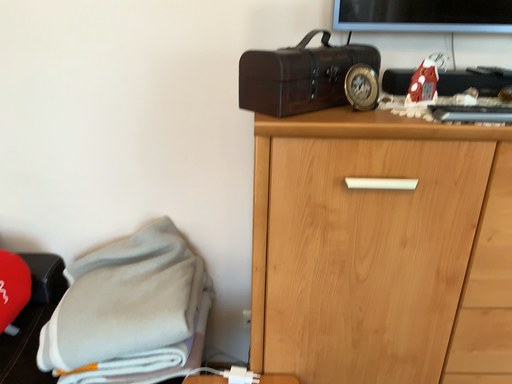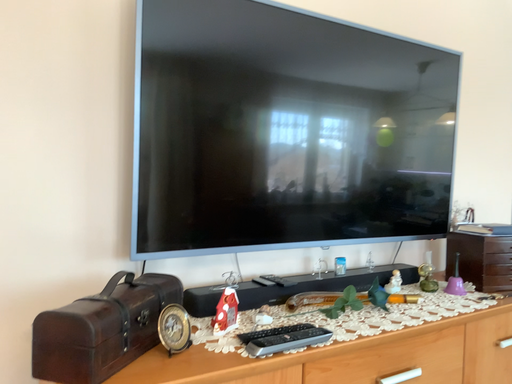
Question: How did the camera likely rotate when shooting the video?

Choices:
 (A) rotated downward
 (B) rotated upward

Answer: (B)